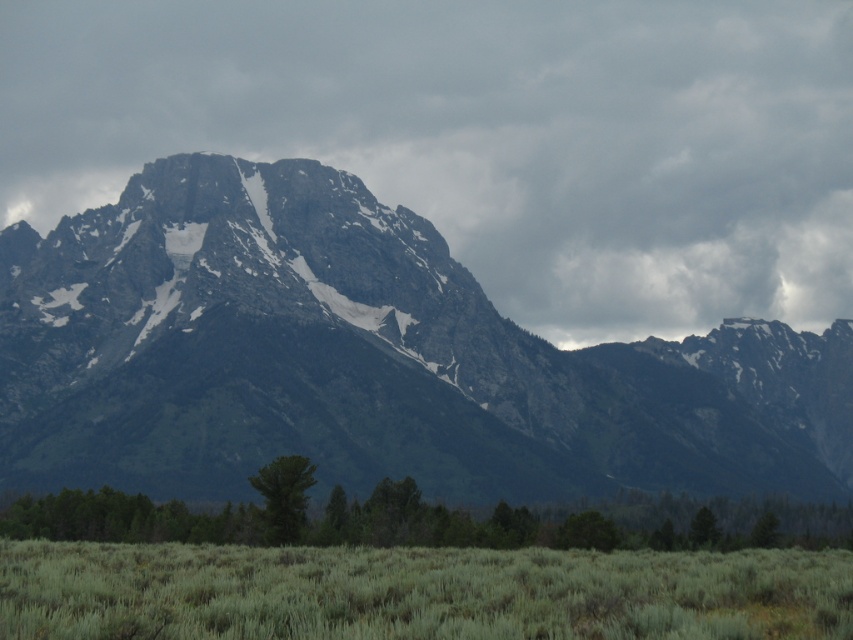
Question: Which point is closer to the camera?

Choices:
 (A) (572, 586)
 (B) (746, 376)
 (C) (270, 532)
 (D) (514, 525)

Answer: (A)

Question: Based on their relative distances, which object is farther from the green grassy field at lower center?

Choices:
 (A) gray rock mountain range at center
 (B) green matte tree at center
 (C) green leafy tree at lower center
 (D) gray rock mountain at center

Answer: (D)

Question: Which of the following is the farthest from the observer?

Choices:
 (A) green matte tree at center
 (B) gray rock mountain at center
 (C) green grassy field at lower center

Answer: (B)

Question: Can you confirm if green grassy field at lower center is bigger than green leafy tree at lower center?

Choices:
 (A) yes
 (B) no

Answer: (A)

Question: In this image, where is gray rock mountain at center located relative to green grassy field at lower center?

Choices:
 (A) right
 (B) left

Answer: (B)

Question: Does gray rock mountain at center appear on the left side of gray rock mountain range at center?

Choices:
 (A) yes
 (B) no

Answer: (A)